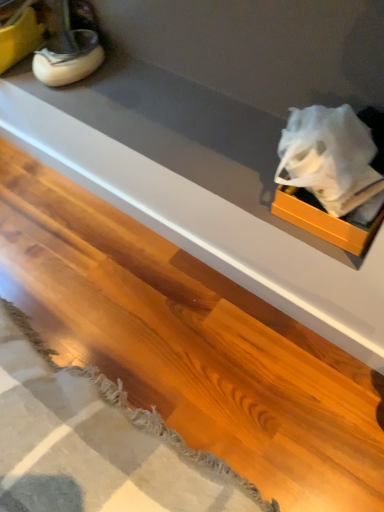
Question: Looking at the image, does white rubber shoe at upper left seem bigger or smaller compared to matte white counter at upper right?

Choices:
 (A) small
 (B) big

Answer: (A)

Question: Is point (77, 49) positioned closer to the camera than point (162, 106)?

Choices:
 (A) closer
 (B) farther

Answer: (B)

Question: Which object is positioned closest to the white rubber shoe at upper left?

Choices:
 (A) matte white counter at upper right
 (B) orange matte box at upper right

Answer: (A)

Question: Which object is positioned closest to the white rubber shoe at upper left?

Choices:
 (A) matte white counter at upper right
 (B) orange matte box at upper right

Answer: (A)